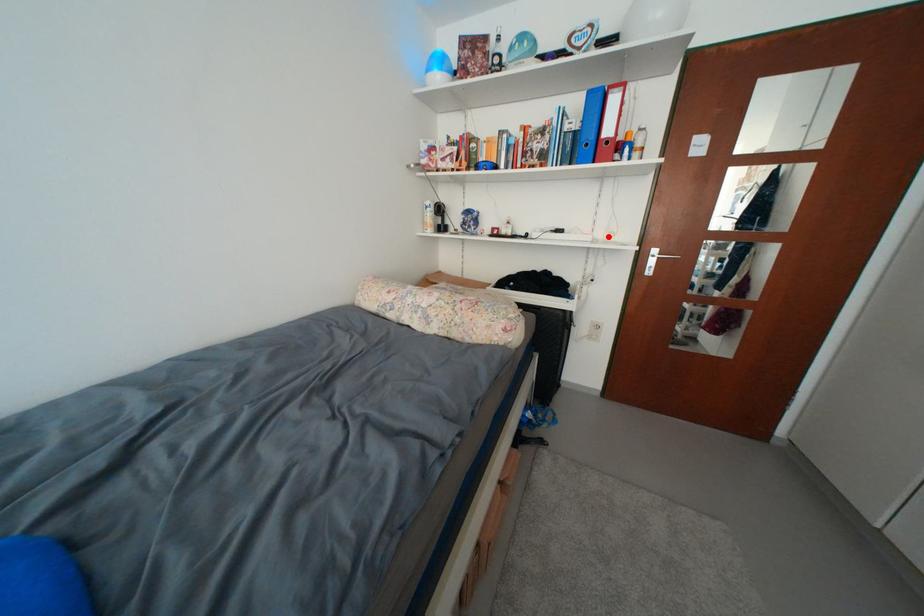
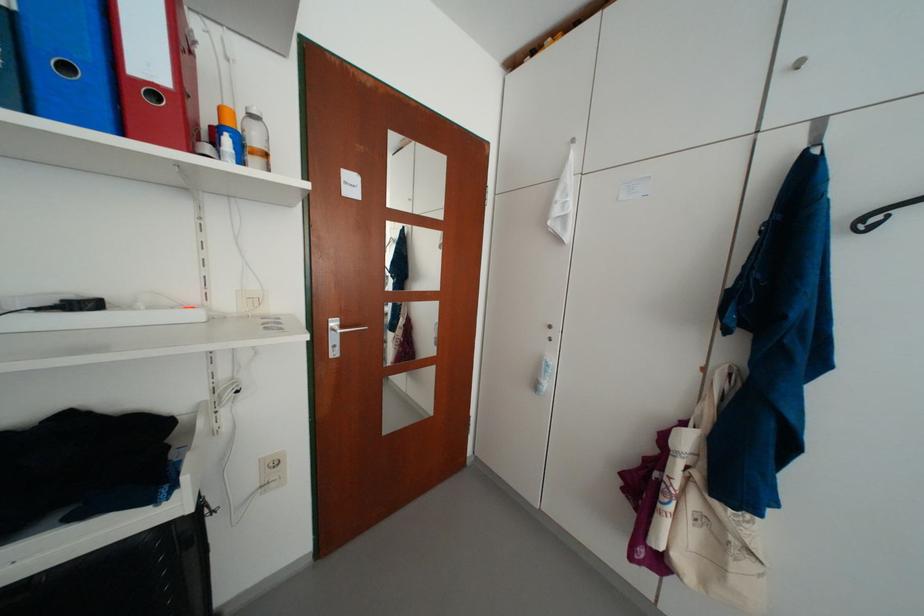
Question: I am providing you with two images of the same scene from different viewpoints. A red point is shown in image1. For the corresponding object point in image2, is it positioned nearer or farther from the camera?

Choices:
 (A) Nearer
 (B) Farther

Answer: (B)